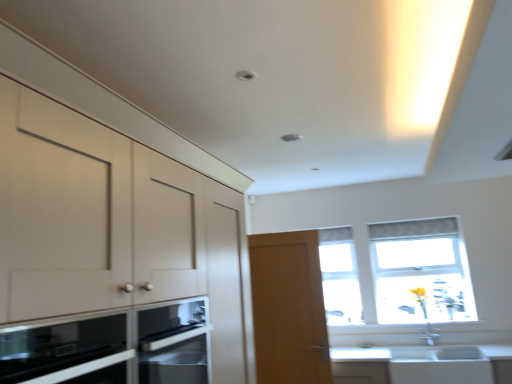
Question: Is there a large distance between light brown wooden door at center and matte white cabinets at left?

Choices:
 (A) yes
 (B) no

Answer: (A)

Question: Considering the relative positions of light brown wooden door at center and matte white cabinets at left in the image provided, is light brown wooden door at center behind matte white cabinets at left?

Choices:
 (A) yes
 (B) no

Answer: (A)

Question: Considering the relative sizes of light brown wooden door at center and matte white cabinets at left in the image provided, is light brown wooden door at center wider than matte white cabinets at left?

Choices:
 (A) no
 (B) yes

Answer: (A)

Question: Can you confirm if light brown wooden door at center is shorter than matte white cabinets at left?

Choices:
 (A) no
 (B) yes

Answer: (A)

Question: Considering the relative sizes of light brown wooden door at center and matte white cabinets at left in the image provided, is light brown wooden door at center smaller than matte white cabinets at left?

Choices:
 (A) no
 (B) yes

Answer: (B)

Question: Does point (249, 253) appear closer or farther from the camera than point (130, 107)?

Choices:
 (A) farther
 (B) closer

Answer: (A)

Question: In terms of height, does light brown wooden door at center look taller or shorter compared to matte white cabinets at left?

Choices:
 (A) short
 (B) tall

Answer: (B)

Question: From the image's perspective, is light brown wooden door at center located above or below matte white cabinets at left?

Choices:
 (A) above
 (B) below

Answer: (B)

Question: Would you say light brown wooden door at center is to the left or to the right of matte white cabinets at left in the picture?

Choices:
 (A) right
 (B) left

Answer: (A)

Question: Considering their positions, is black glass microwave oven at lower left located in front of or behind transparent glass window at upper right, the 1th window when ordered from right to left?

Choices:
 (A) behind
 (B) front

Answer: (B)

Question: Considering the positions of black glass microwave oven at lower left and transparent glass window at upper right, the 1th window when ordered from right to left, in the image, is black glass microwave oven at lower left taller or shorter than transparent glass window at upper right, the 1th window when ordered from right to left,?

Choices:
 (A) short
 (B) tall

Answer: (A)

Question: From the image's perspective, is black glass microwave oven at lower left located above or below transparent glass window at upper right, marked as the 2th window in a left-to-right arrangement?

Choices:
 (A) above
 (B) below

Answer: (A)

Question: Which is correct: black glass microwave oven at lower left is inside transparent glass window at upper right, marked as the 2th window in a left-to-right arrangement, or outside of it?

Choices:
 (A) outside
 (B) inside

Answer: (A)

Question: From the image's perspective, is clear glass window at center, the second window when ordered from right to left, above or below light brown wooden door at center?

Choices:
 (A) above
 (B) below

Answer: (A)

Question: Choose the correct answer: Is clear glass window at center, the second window when ordered from right to left, inside light brown wooden door at center or outside it?

Choices:
 (A) outside
 (B) inside

Answer: (A)